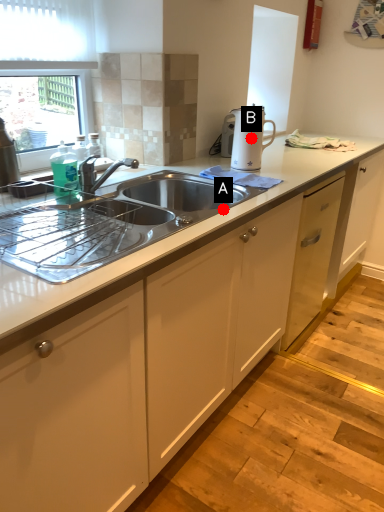
Question: Two points are circled on the image, labeled by A and B beside each circle. Which point is closer to the camera?

Choices:
 (A) A is closer
 (B) B is closer

Answer: (A)